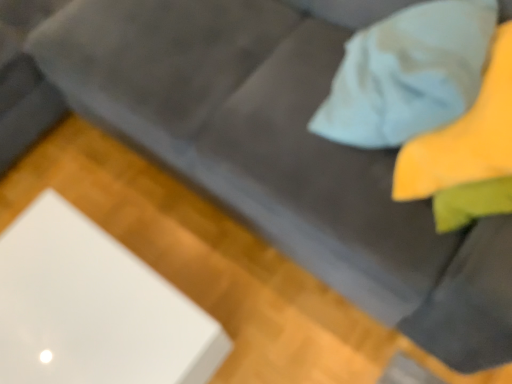
Question: Does white glossy cube at lower left have a smaller size compared to yellow fabric pillow at upper right?

Choices:
 (A) no
 (B) yes

Answer: (A)

Question: From a real-world perspective, is white glossy cube at lower left on top of yellow fabric pillow at upper right?

Choices:
 (A) yes
 (B) no

Answer: (B)

Question: Would you consider white glossy cube at lower left to be distant from yellow fabric pillow at upper right?

Choices:
 (A) no
 (B) yes

Answer: (A)

Question: Is the depth of white glossy cube at lower left less than that of yellow fabric pillow at upper right?

Choices:
 (A) yes
 (B) no

Answer: (B)

Question: Is white glossy cube at lower left shorter than yellow fabric pillow at upper right?

Choices:
 (A) yes
 (B) no

Answer: (B)

Question: Can we say white glossy cube at lower left lies outside yellow fabric pillow at upper right?

Choices:
 (A) yes
 (B) no

Answer: (A)

Question: Would you say white glossy cube at lower left is part of yellow fabric pillow at upper right's contents?

Choices:
 (A) no
 (B) yes

Answer: (A)

Question: Is yellow fabric pillow at upper right touching white glossy cube at lower left?

Choices:
 (A) no
 (B) yes

Answer: (A)

Question: From the image's perspective, is yellow fabric pillow at upper right below white glossy cube at lower left?

Choices:
 (A) no
 (B) yes

Answer: (A)

Question: Does yellow fabric pillow at upper right have a greater height compared to white glossy cube at lower left?

Choices:
 (A) yes
 (B) no

Answer: (B)

Question: Considering the relative sizes of yellow fabric pillow at upper right and white glossy cube at lower left in the image provided, is yellow fabric pillow at upper right thinner than white glossy cube at lower left?

Choices:
 (A) yes
 (B) no

Answer: (A)

Question: Does yellow fabric pillow at upper right appear on the left side of white glossy cube at lower left?

Choices:
 (A) yes
 (B) no

Answer: (B)

Question: Is point (422, 21) closer or farther from the camera than point (116, 317)?

Choices:
 (A) closer
 (B) farther

Answer: (A)